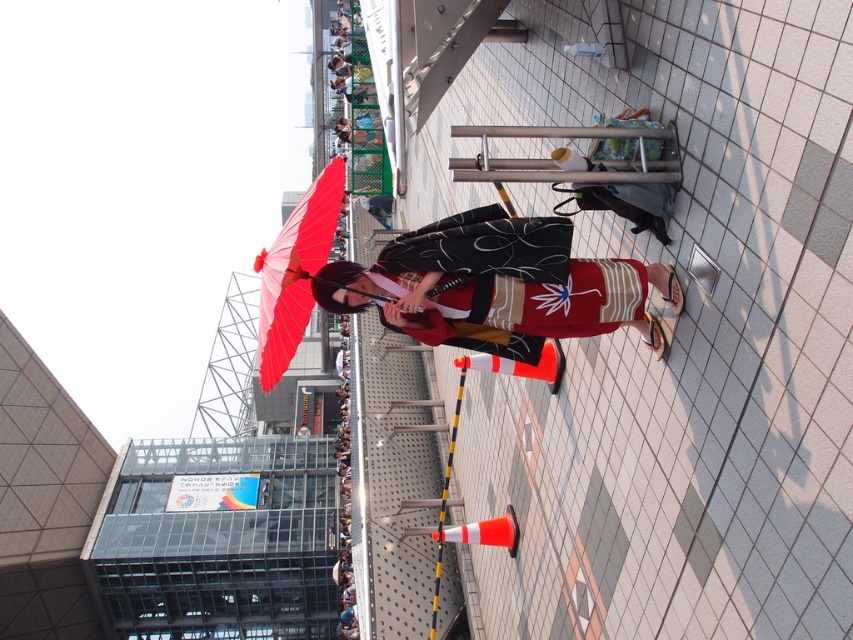
Question: Which of the following is the closest to the observer?

Choices:
 (A) (598, 307)
 (B) (300, 250)

Answer: (A)

Question: Which of the following is the closest to the observer?

Choices:
 (A) (289, 225)
 (B) (436, 285)

Answer: (B)

Question: Which point is closer to the camera?

Choices:
 (A) (329, 188)
 (B) (514, 288)

Answer: (B)

Question: Is matte kimono at center positioned behind matte red umbrella at center?

Choices:
 (A) no
 (B) yes

Answer: (A)

Question: Does matte kimono at center appear over matte red umbrella at center?

Choices:
 (A) no
 (B) yes

Answer: (A)

Question: Is matte kimono at center above matte red umbrella at center?

Choices:
 (A) yes
 (B) no

Answer: (B)